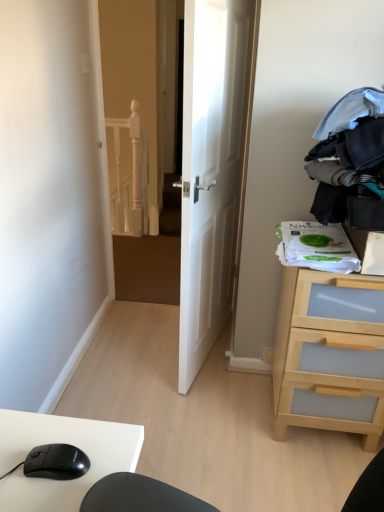
Where is `vacant space situated on the left part of white glossy door at center`? vacant space situated on the left part of white glossy door at center is located at coordinates (140, 343).